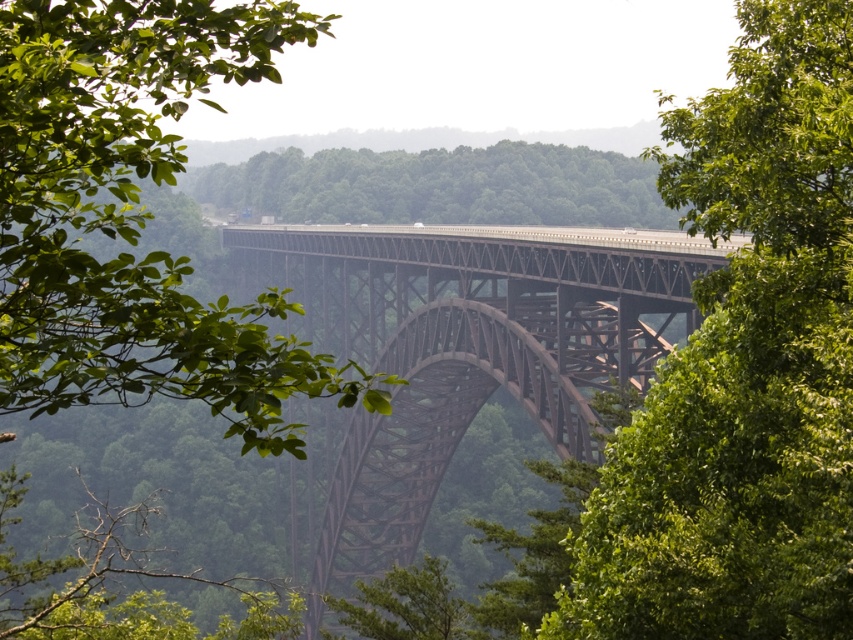
Between green leafy tree at center and rusty metal bridge at center, which one is positioned lower?

rusty metal bridge at center

Is the position of green leafy tree at center more distant than that of rusty metal bridge at center?

No.

Measure the distance between point (843, 72) and camera.

51.22 meters

You are a GUI agent. You are given a task and a screenshot of the screen. Output one action in this format:
    pyautogui.click(x=<x>, y=<y>)
    Task: Click on the green leafy tree at center
    
    Given the screenshot: What is the action you would take?
    pyautogui.click(x=743, y=369)